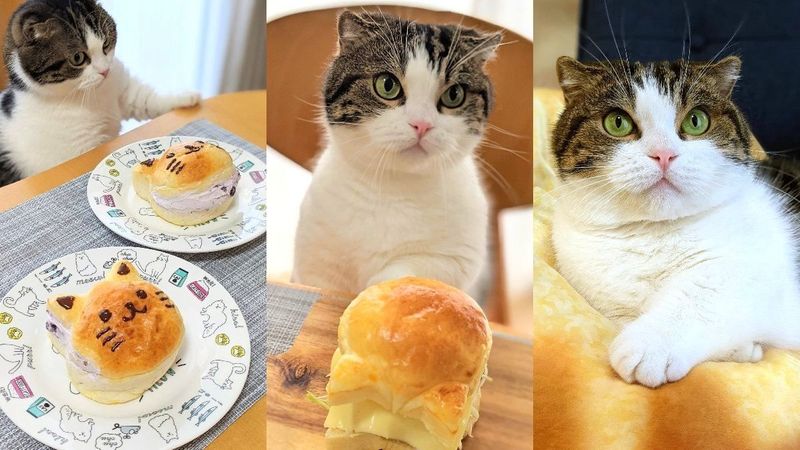
Find the location of `white fur`. white fur is located at coordinates (718, 285), (414, 202), (74, 123).